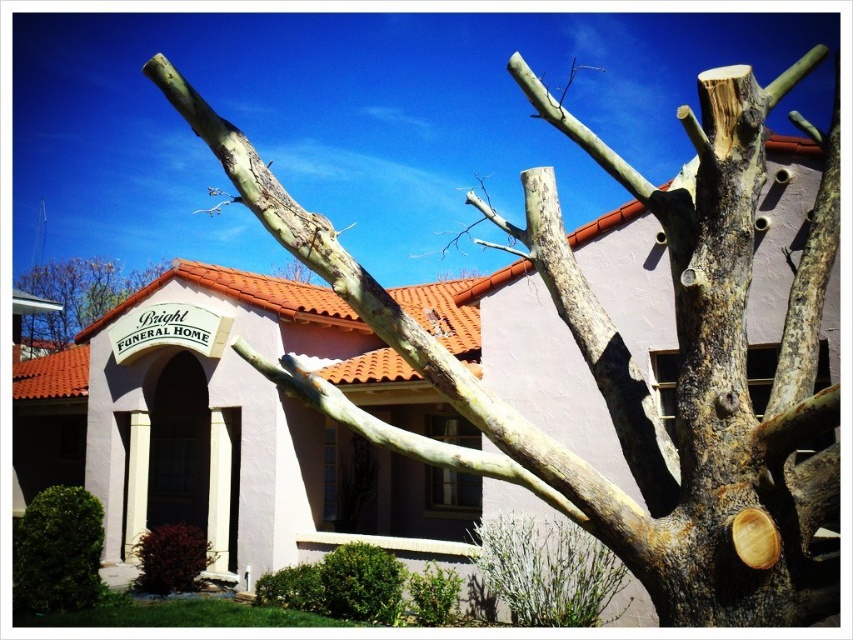
You are standing at the entrance of the Bright Funeral Home and see two points marked on the ground. One is at point (x=734, y=442) and the other at point (x=57, y=314). If you want to walk towards the point that is closer to the tree in the foreground, which point should you go to?

Point (x=734, y=442) is in front of point (x=57, y=314), so walking towards point (x=734, y=442) will bring you closer to the tree in the foreground.

You are standing at the entrance of the Bright Funeral Home and want to take a photo of the brown rough bark tree at upper right. Where should you position yourself to capture the tree in the frame?

To capture the brown rough bark tree at upper right in the frame, position yourself at the entrance of the Bright Funeral Home and aim your camera towards the upper right area, specifically targeting the coordinates point at (630, 360) where the tree is located.